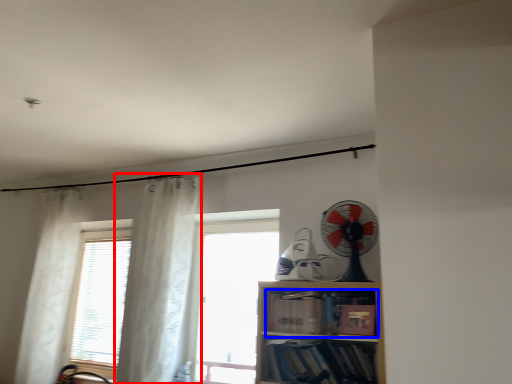
Question: Which point is further to the camera, curtain (highlighted by a red box) or book (highlighted by a blue box)?

Choices:
 (A) curtain
 (B) book

Answer: (A)